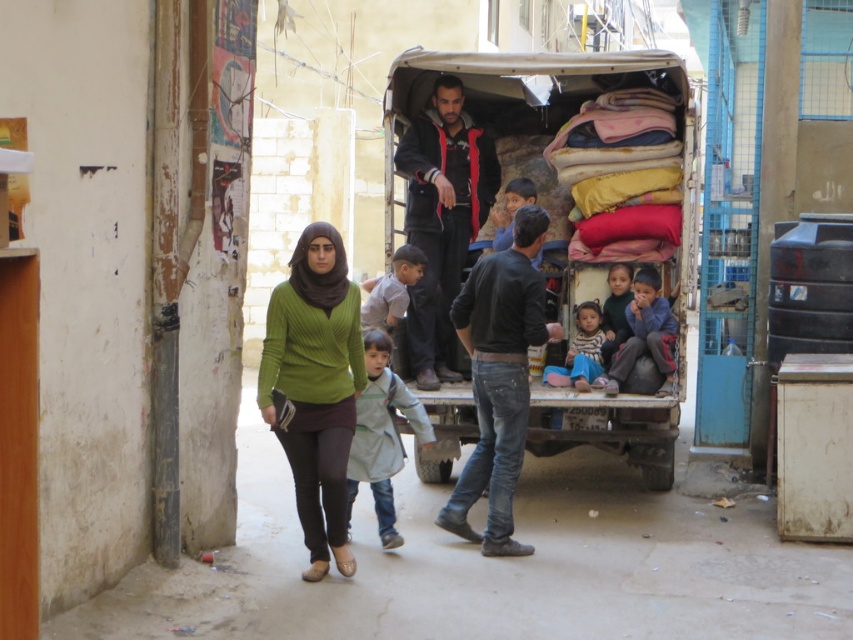
Question: Estimate the real-world distances between objects in this image. Which object is farther from the light gray fabric jacket at center?

Choices:
 (A) textured fabric cart at center
 (B) light brown fabric pants at lower right

Answer: (A)

Question: Is textured fabric cart at center positioned behind striped cotton shirt at center?

Choices:
 (A) yes
 (B) no

Answer: (B)

Question: Which point is closer to the camera?

Choices:
 (A) (351, 400)
 (B) (572, 362)
 (C) (566, 56)
 (D) (408, 412)

Answer: (A)

Question: Can you confirm if green ribbed sweater at center is bigger than light brown fabric pants at lower right?

Choices:
 (A) yes
 (B) no

Answer: (A)

Question: Which point is farther from the camera taking this photo?

Choices:
 (A) (334, 266)
 (B) (581, 381)
 (C) (663, 312)
 (D) (392, 385)

Answer: (C)

Question: Is green ribbed sweater at center below light gray fabric jacket at center?

Choices:
 (A) yes
 (B) no

Answer: (B)